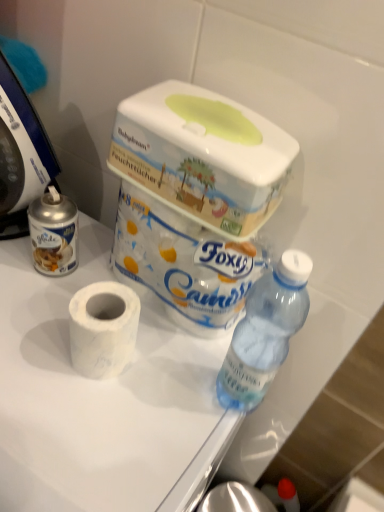
Locate an element on the screen. The height and width of the screenshot is (512, 384). free spot in front of white matte toilet paper at center, which ranks as the second toilet paper in top-to-bottom order is located at coordinates (80, 436).